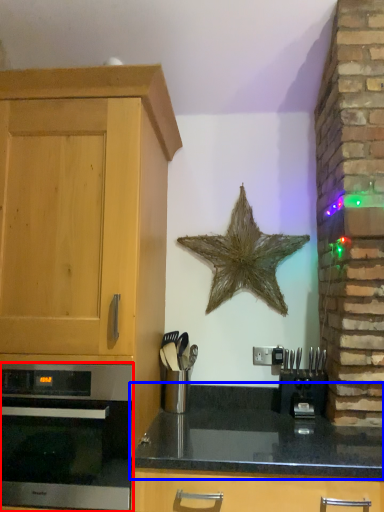
Question: Which object appears farthest to the camera in this image, oven (highlighted by a red box) or countertop (highlighted by a blue box)?

Choices:
 (A) oven
 (B) countertop

Answer: (A)